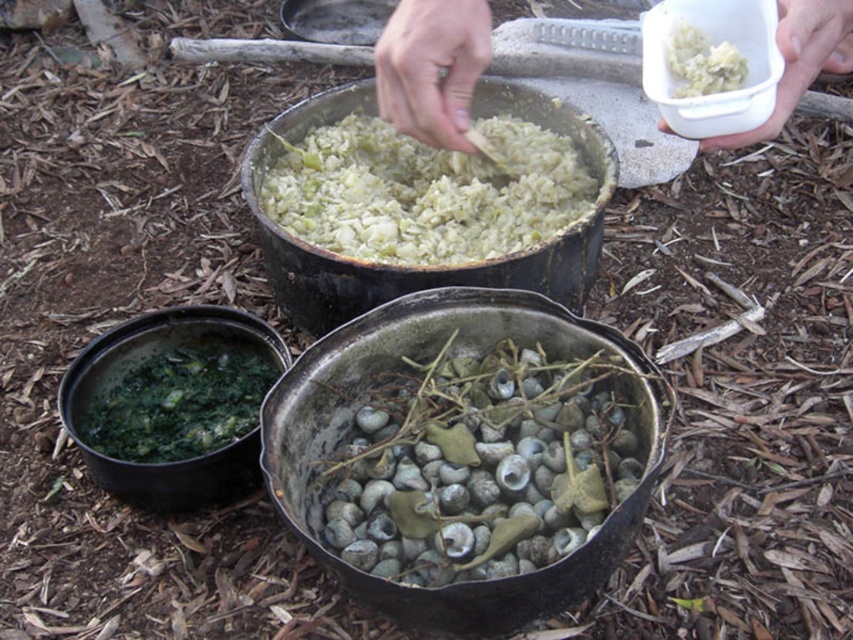
You are setting up a camp kitchen and need to organize your supplies. You have a white plastic container at upper center and a green leafy vegetable at lower left. Based on their positions, which item is higher up in the image?

The white plastic container at upper center is located above the green leafy vegetable at lower left, so it is higher up in the image.

You are standing in the outdoor cooking area and need to reach both points. Which point, point (495,208) or point (107,448), is closer to you?

Point (495,208) is closer to you because it is further to the viewer than point (107,448).

You are standing 5 feet away from the green matte rice at center. Can you reach it without moving your feet?

The green matte rice at center is 4.72 feet away from the viewer, so yes, you can reach it without moving your feet since it is within the 5 feet distance.